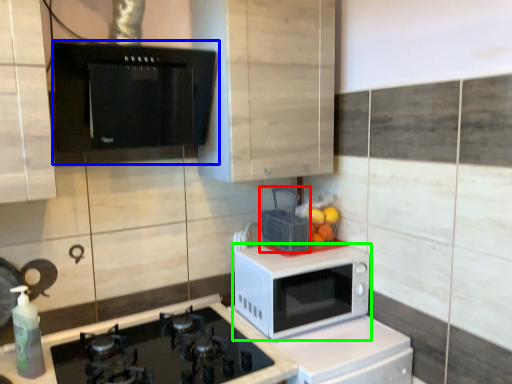
Question: Which is farther away from basket (highlighted by a red box)? appliance (highlighted by a blue box) or microwave oven (highlighted by a green box)?

Choices:
 (A) appliance
 (B) microwave oven

Answer: (A)